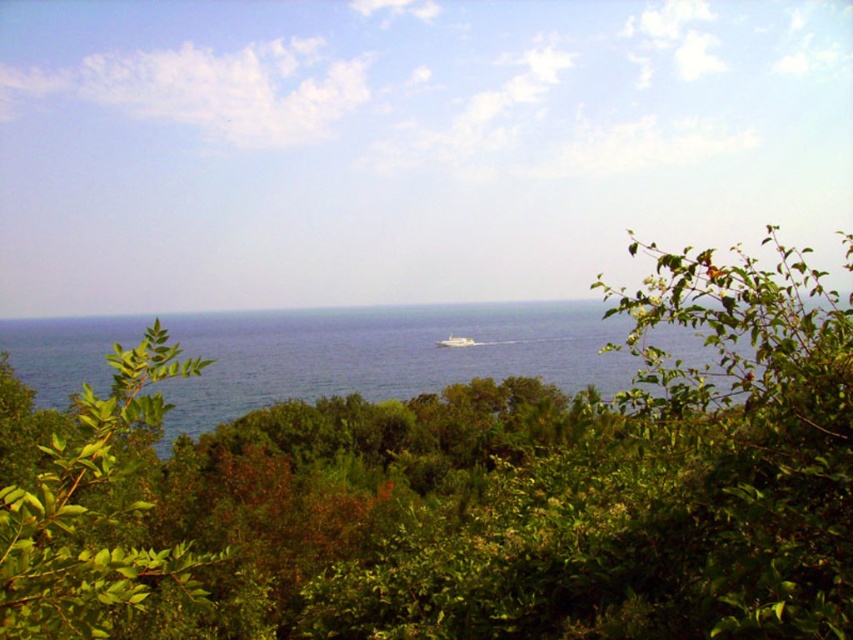
Does blue water at center appear over green leafy tree at center?

Correct, blue water at center is located above green leafy tree at center.

Between blue water at center and green leafy tree at center, which one is positioned higher?

Positioned higher is blue water at center.

Who is more distant from viewer, (381, 337) or (112, 435)?

The point (381, 337) is behind.

At what (x,y) coordinates should I click in order to perform the action: click on blue water at center. Please return your answer as a coordinate pair (x, y). Looking at the image, I should click on pos(386,353).

Between point (148, 362) and point (476, 342), which one is positioned in front?

Point (148, 362) is in front.

Between green leafy tree at center and white glossy boat at center, which one appears on the right side from the viewer's perspective?

white glossy boat at center is more to the right.

Identify the location of green leafy tree at center. (90, 513).

Does blue water at center come behind white glossy boat at center?

No, it is not.

Who is shorter, blue water at center or white glossy boat at center?

white glossy boat at center is shorter.

Is point (71, 317) behind point (456, 340)?

Yes, point (71, 317) is farther from viewer.

Find the location of a particular element. blue water at center is located at coordinates (386, 353).